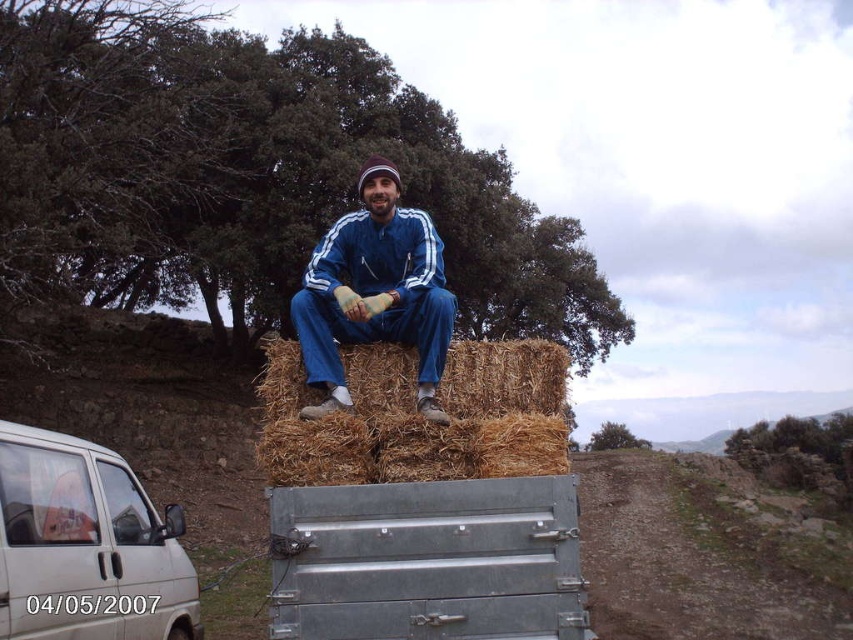
Is brown straw bale at upper center smaller than white matte van at lower left?

Yes, brown straw bale at upper center is smaller than white matte van at lower left.

Measure the distance between brown straw bale at upper center and white matte van at lower left.

brown straw bale at upper center and white matte van at lower left are 1.44 meters apart from each other.

At what (x,y) coordinates should I click in order to perform the action: click on brown straw bale at upper center. Please return your answer as a coordinate pair (x, y). Image resolution: width=853 pixels, height=640 pixels. Looking at the image, I should click on (418, 416).

The image size is (853, 640). I want to click on brown straw bale at upper center, so tap(418, 416).

Does galvanized metal crate at center have a lesser width compared to brown straw bale at upper center?

Correct, galvanized metal crate at center's width is less than brown straw bale at upper center's.

Can you confirm if galvanized metal crate at center is smaller than brown straw bale at upper center?

Yes.

Between point (421, 595) and point (346, 376), which one is positioned behind?

Point (346, 376)

What are the coordinates of `galvanized metal crate at center` in the screenshot? It's located at (428, 561).

Is brown straw bale at upper center above blue fabric pants at center?

Actually, brown straw bale at upper center is below blue fabric pants at center.

Is point (389, 353) positioned after point (444, 305)?

Yes, it is behind point (444, 305).

Is point (552, 400) less distant than point (347, 392)?

No, (552, 400) is behind (347, 392).

I want to click on brown straw bale at upper center, so click(418, 416).